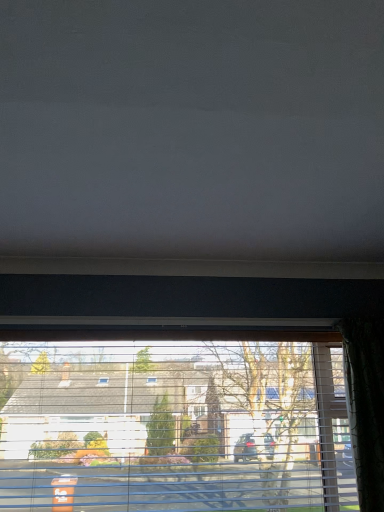
Describe the element at coordinates (192, 129) in the screenshot. I see `matte gray blind at upper center` at that location.

The height and width of the screenshot is (512, 384). Identify the location of matte gray blind at upper center. (192, 129).

Describe the element at coordinates (174, 426) in the screenshot. I see `transparent plastic window at center` at that location.

Where is `transparent plastic window at center`? transparent plastic window at center is located at coordinates (174, 426).

Locate an element on the screen. matte gray blind at upper center is located at coordinates (192, 129).

Considering the positions of objects transparent plastic window at center and matte gray blind at upper center in the image provided, who is more to the right, transparent plastic window at center or matte gray blind at upper center?

matte gray blind at upper center.

Is transparent plastic window at center further to the viewer compared to matte gray blind at upper center?

Yes, it is.

Which is behind, point (275, 504) or point (311, 155)?

Positioned behind is point (275, 504).

From the image's perspective, which one is positioned lower, transparent plastic window at center or matte gray blind at upper center?

transparent plastic window at center appears lower in the image.

Consider the image. From a real-world perspective, is transparent plastic window at center above or below matte gray blind at upper center?

transparent plastic window at center is situated lower than matte gray blind at upper center in the real world.

Can you confirm if transparent plastic window at center is thinner than matte gray blind at upper center?

Yes, transparent plastic window at center is thinner than matte gray blind at upper center.

Is transparent plastic window at center taller or shorter than matte gray blind at upper center?

transparent plastic window at center is taller than matte gray blind at upper center.

Does transparent plastic window at center have a smaller size compared to matte gray blind at upper center?

Indeed, transparent plastic window at center has a smaller size compared to matte gray blind at upper center.

Is transparent plastic window at center outside of matte gray blind at upper center?

Yes, transparent plastic window at center is located beyond the bounds of matte gray blind at upper center.

Does transparent plastic window at center touch matte gray blind at upper center?

transparent plastic window at center and matte gray blind at upper center are not in contact.

Consider the image. Is matte gray blind at upper center at the back of transparent plastic window at center?

That's not correct — transparent plastic window at center is not looking away from matte gray blind at upper center.

How many degrees apart are the facing directions of transparent plastic window at center and matte gray blind at upper center?

The facing directions of transparent plastic window at center and matte gray blind at upper center are 0.0921 degrees apart.

The image size is (384, 512). I want to click on blind that appears on the right of transparent plastic window at center, so click(192, 129).

In the scene shown: Is matte gray blind at upper center to the left of transparent plastic window at center from the viewer's perspective?

No, matte gray blind at upper center is not to the left of transparent plastic window at center.

Relative to transparent plastic window at center, is matte gray blind at upper center in front or behind?

Visually, matte gray blind at upper center is located in front of transparent plastic window at center.

Is point (20, 131) closer to viewer compared to point (103, 449)?

Yes, point (20, 131) is in front of point (103, 449).

From the image's perspective, is matte gray blind at upper center above transparent plastic window at center?

Yes, from the image's perspective, matte gray blind at upper center is on top of transparent plastic window at center.

From a real-world perspective, is matte gray blind at upper center below transparent plastic window at center?

No, from a real-world perspective, matte gray blind at upper center is not beneath transparent plastic window at center.

Between matte gray blind at upper center and transparent plastic window at center, which one has smaller width?

transparent plastic window at center.

Considering the sizes of objects matte gray blind at upper center and transparent plastic window at center in the image provided, who is taller, matte gray blind at upper center or transparent plastic window at center?

transparent plastic window at center is taller.

Based on their sizes in the image, would you say matte gray blind at upper center is bigger or smaller than transparent plastic window at center?

Clearly, matte gray blind at upper center is larger in size than transparent plastic window at center.

Which is correct: matte gray blind at upper center is inside transparent plastic window at center, or outside of it?

matte gray blind at upper center is not inside transparent plastic window at center, it's outside.

Are matte gray blind at upper center and transparent plastic window at center located far from each other?

Absolutely, matte gray blind at upper center is distant from transparent plastic window at center.

Does matte gray blind at upper center turn towards transparent plastic window at center?

No, matte gray blind at upper center is not oriented towards transparent plastic window at center.

What's the angular difference between matte gray blind at upper center and transparent plastic window at center's facing directions?

matte gray blind at upper center and transparent plastic window at center are facing 0.0921 degrees away from each other.

Where is `blind on the right of transparent plastic window at center`? blind on the right of transparent plastic window at center is located at coordinates (192, 129).

You are a GUI agent. You are given a task and a screenshot of the screen. Output one action in this format:
    pyautogui.click(x=<x>, y=<y>)
    Task: Click on the window beneath the matte gray blind at upper center (from a real-world perspective)
    
    Given the screenshot: What is the action you would take?
    pyautogui.click(x=174, y=426)

Where is `window behind the matte gray blind at upper center`? This screenshot has width=384, height=512. window behind the matte gray blind at upper center is located at coordinates (174, 426).